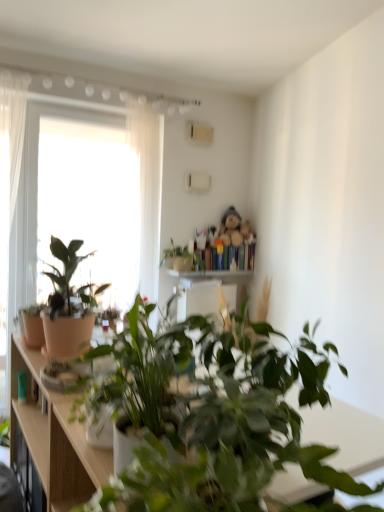
Question: From the image's perspective, is green matte plant at upper center, placed as the first houseplant when sorted from back to front, positioned above or below matte white pot at center, the first houseplant in the front-to-back sequence?

Choices:
 (A) above
 (B) below

Answer: (A)

Question: Based on their positions, is green matte plant at upper center, placed as the first houseplant when sorted from back to front, located to the left or right of matte white pot at center, which is the fourth houseplant in back-to-front order?

Choices:
 (A) right
 (B) left

Answer: (A)

Question: Which is farther from the green matte plant at upper center, placed as the first houseplant when sorted from back to front?

Choices:
 (A) fluffy beige teddy bear at upper center
 (B) wooden bookshelf at upper center
 (C) matte brown cabinet at left
 (D) matte terracotta pot at left, arranged as the second houseplant when viewed from the back
 (E) wooden at center

Answer: (C)

Question: Which is nearer to the matte terracotta pot at left, arranged as the third houseplant when viewed from the front?

Choices:
 (A) white sheer curtain at upper left
 (B) green matte plant at upper center, placed as the first houseplant when sorted from back to front
 (C) wooden bookshelf at upper center
 (D) fluffy beige teddy bear at upper center
 (E) transparent glass window at upper left

Answer: (A)